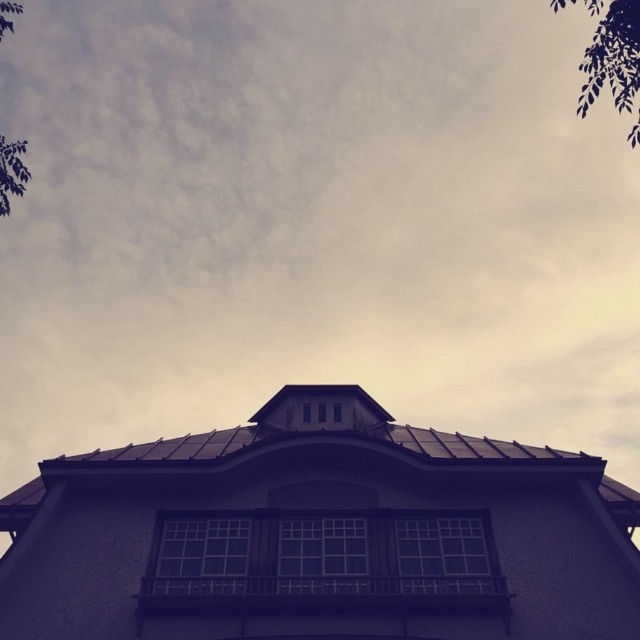
You are standing below the building and looking up. You see the metallic gray roof at center and the dark green leafy branch at upper right. Which object is closer to the sky?

The dark green leafy branch at upper right is closer to the sky because it is taller than the metallic gray roof at center.

From the picture: You are standing on the ground looking up at the building. Which object is higher up in the sky between the metallic gray roof at center and the dark green leafy branch at upper right?

The dark green leafy branch at upper right is higher up in the sky than the metallic gray roof at center because it is positioned above it.